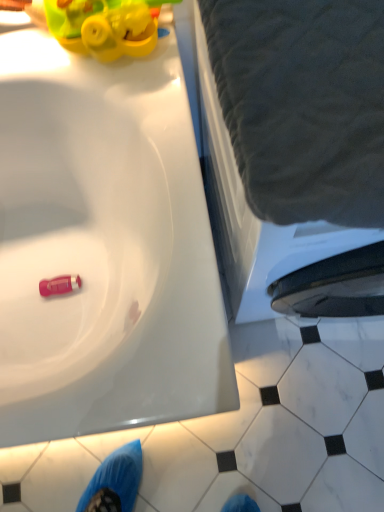
Question: Is pink rubber toy at lower left placed right next to white marble tile at lower right?

Choices:
 (A) no
 (B) yes

Answer: (A)

Question: Is pink rubber toy at lower left shorter than white marble tile at lower right?

Choices:
 (A) yes
 (B) no

Answer: (B)

Question: Is pink rubber toy at lower left not near white marble tile at lower right?

Choices:
 (A) no
 (B) yes

Answer: (A)

Question: Considering the relative sizes of pink rubber toy at lower left and white marble tile at lower right in the image provided, is pink rubber toy at lower left wider than white marble tile at lower right?

Choices:
 (A) no
 (B) yes

Answer: (A)

Question: Can white marble tile at lower right be found inside pink rubber toy at lower left?

Choices:
 (A) yes
 (B) no

Answer: (B)

Question: Does pink rubber toy at lower left have a greater height compared to white marble tile at lower right?

Choices:
 (A) yes
 (B) no

Answer: (A)

Question: Are pink rubber toy at lower left and gray fabric at upper right beside each other?

Choices:
 (A) yes
 (B) no

Answer: (B)

Question: Is pink rubber toy at lower left located outside gray fabric at upper right?

Choices:
 (A) yes
 (B) no

Answer: (A)

Question: From a real-world perspective, is pink rubber toy at lower left on gray fabric at upper right?

Choices:
 (A) no
 (B) yes

Answer: (A)

Question: From the image's perspective, is pink rubber toy at lower left beneath gray fabric at upper right?

Choices:
 (A) no
 (B) yes

Answer: (B)

Question: Considering the relative positions of pink rubber toy at lower left and gray fabric at upper right in the image provided, is pink rubber toy at lower left to the left of gray fabric at upper right from the viewer's perspective?

Choices:
 (A) no
 (B) yes

Answer: (B)

Question: Is pink rubber toy at lower left thinner than gray fabric at upper right?

Choices:
 (A) yes
 (B) no

Answer: (A)

Question: Does white marble tile at lower right contain pink rubber toy at lower left?

Choices:
 (A) no
 (B) yes

Answer: (A)